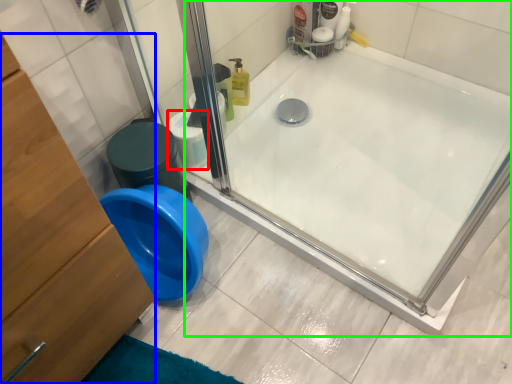
Question: Which object is the farthest from toilet paper (highlighted by a red box)? Choose among these: dresser (highlighted by a blue box) or bathtub (highlighted by a green box).

Choices:
 (A) dresser
 (B) bathtub

Answer: (A)